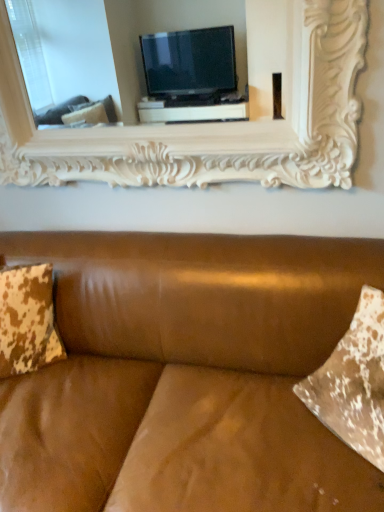
Question: Is brown leather couch at center thinner than brown distressed fabric pillow at left?

Choices:
 (A) no
 (B) yes

Answer: (A)

Question: Considering the relative sizes of brown leather couch at center and brown distressed fabric pillow at left in the image provided, is brown leather couch at center wider than brown distressed fabric pillow at left?

Choices:
 (A) no
 (B) yes

Answer: (B)

Question: Can you confirm if brown leather couch at center is taller than brown distressed fabric pillow at left?

Choices:
 (A) no
 (B) yes

Answer: (B)

Question: Is brown leather couch at center bigger than brown distressed fabric pillow at left?

Choices:
 (A) no
 (B) yes

Answer: (B)

Question: Is brown leather couch at center shorter than brown distressed fabric pillow at left?

Choices:
 (A) yes
 (B) no

Answer: (B)

Question: Is brown leather couch at center further to the viewer compared to brown distressed fabric pillow at left?

Choices:
 (A) no
 (B) yes

Answer: (A)

Question: From a real-world perspective, is brown distressed fabric pillow at left below brown leather couch at center?

Choices:
 (A) yes
 (B) no

Answer: (B)

Question: Is brown distressed fabric pillow at left smaller than brown leather couch at center?

Choices:
 (A) no
 (B) yes

Answer: (B)

Question: Does brown distressed fabric pillow at left have a lesser height compared to brown leather couch at center?

Choices:
 (A) no
 (B) yes

Answer: (B)

Question: Is brown distressed fabric pillow at left oriented towards brown leather couch at center?

Choices:
 (A) yes
 (B) no

Answer: (A)

Question: Is brown leather couch at center completely or partially inside brown distressed fabric pillow at left?

Choices:
 (A) yes
 (B) no

Answer: (B)

Question: Does brown distressed fabric pillow at left have a larger size compared to brown leather couch at center?

Choices:
 (A) no
 (B) yes

Answer: (A)

Question: Is white carved wood picture frame at upper center behind brown leather couch at center?

Choices:
 (A) yes
 (B) no

Answer: (A)